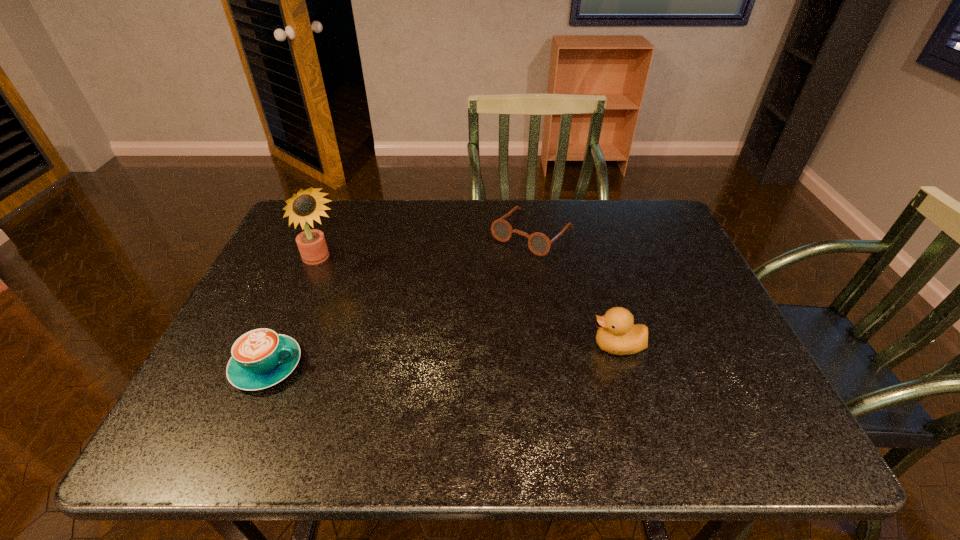
The image size is (960, 540). I want to click on vacant position located on the face of the sunflower, so pos(396,351).

This screenshot has width=960, height=540. What are the coordinates of `vacant space positioned on the front-facing side of the spectacles` in the screenshot? It's located at (436, 338).

Where is `free location located 0.240m on the front-facing side of the spectacles`? The image size is (960, 540). free location located 0.240m on the front-facing side of the spectacles is located at coordinates (465, 307).

I want to click on free location located 0.390m on the front-facing side of the spectacles, so click(427, 347).

Identify the location of object located in the far edge section of the desktop. The height and width of the screenshot is (540, 960). (539, 244).

This screenshot has width=960, height=540. Find the location of `object located at the near edge`. object located at the near edge is located at coordinates (261, 358).

The height and width of the screenshot is (540, 960). Find the location of `cappuccino positioned at the left edge`. cappuccino positioned at the left edge is located at coordinates (261, 358).

Where is `sunflower that is at the left edge`? The height and width of the screenshot is (540, 960). sunflower that is at the left edge is located at coordinates [x=303, y=207].

Find the location of a particular element. The image size is (960, 540). object that is at the near left corner is located at coordinates (261, 358).

Where is `free space at the far edge`? The height and width of the screenshot is (540, 960). free space at the far edge is located at coordinates (402, 234).